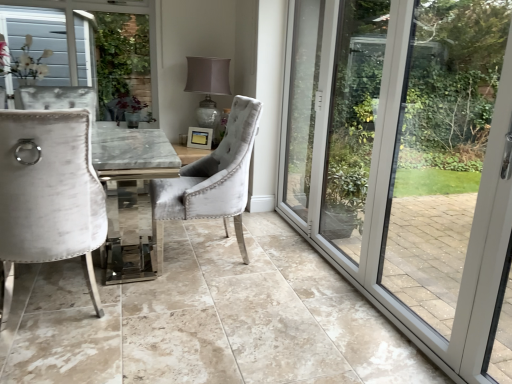
The height and width of the screenshot is (384, 512). I want to click on vacant space that's between transparent glass door at right and velvet grey chair at center, which is counted as the first chair, starting from the right, so click(288, 284).